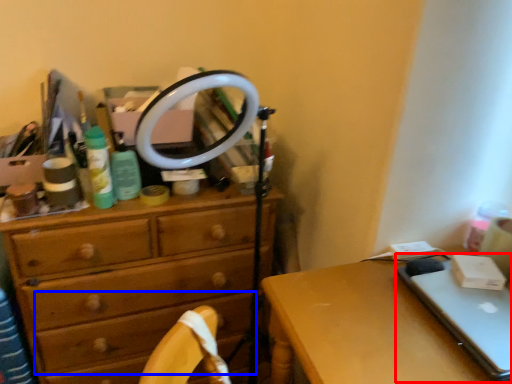
Question: Which point is closer to the camera, laptop (highlighted by a red box) or drawer (highlighted by a blue box)?

Choices:
 (A) laptop
 (B) drawer

Answer: (B)